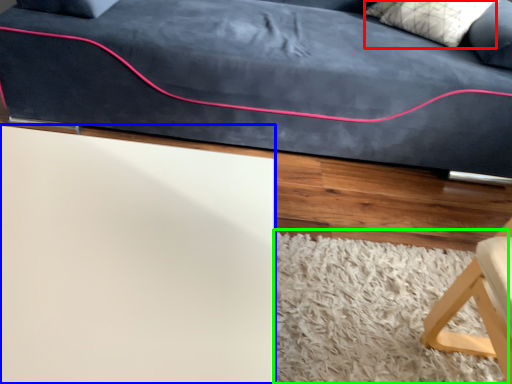
Question: Estimate the real-world distances between objects in this image. Which object is farther from pillow (highlighted by a red box), table (highlighted by a blue box) or mat (highlighted by a green box)?

Choices:
 (A) table
 (B) mat

Answer: (A)